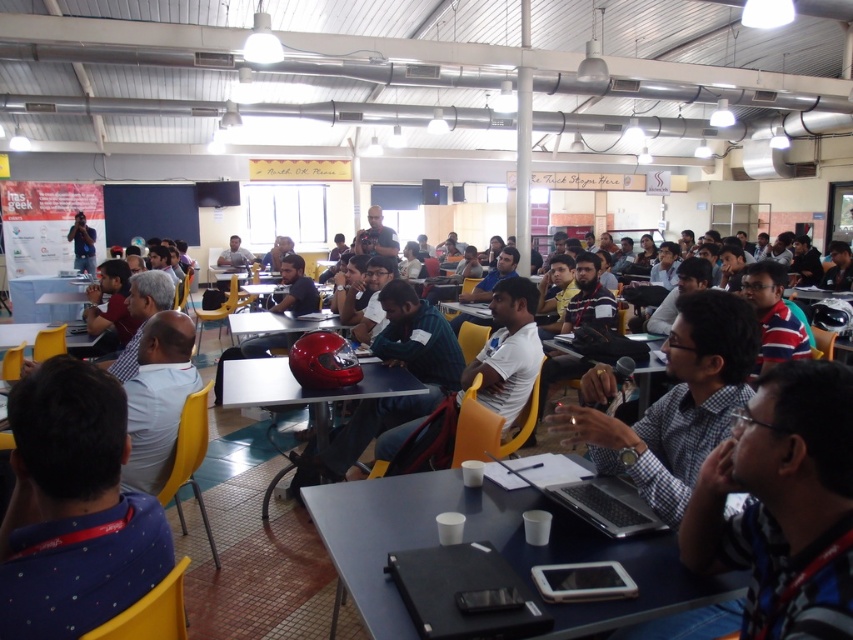
You are organizing a presentation and need to place a large projector remote on the matte black laptop at center and the matte plastic table at center. Which surface will have enough space to accommodate the remote without overlapping the edges?

The matte plastic table at center has a larger size than the matte black laptop at center, so the remote can be placed on the matte plastic table at center without overlapping the edges.

You are standing in the assembly hall and want to take a photo of both point (647, 397) and point (67, 301). Which point should you focus on first to ensure both are in focus?

You should focus on point (647, 397) first because it is closer to the camera than point (67, 301), ensuring both points are within the depth of field.

Looking at this image, you are attending a conference in the assembly hall and need to place a heavy object on the blue plastic table at lower center. However, there is a matte black laptop at center on top of it. Can you safely place the object there without moving the laptop?

The blue plastic table at lower center is positioned under the matte black laptop at center, meaning the laptop is on top of the table. Therefore, placing a heavy object there would require moving the laptop first to avoid damaging it or the table.